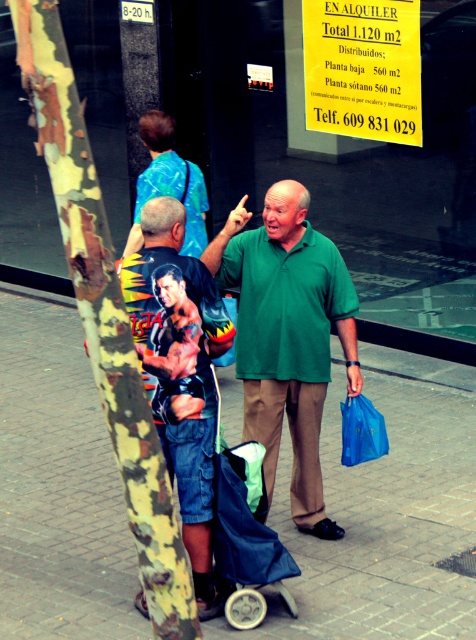
You are standing at the point with coordinates point (191, 230) and want to walk to the point with coordinates point (250, 259). Which direction should you move in?

You should move forward because point (250, 259) is in front of point (191, 230).

You are a delivery person trying to find a landmark to describe to your colleague. You see the camouflage bark tree trunk at left in the scene. Can you provide its coordinates to help locate it?

The camouflage bark tree trunk at left is located at point (105,316), so you can share these coordinates with your colleague to help them locate it.